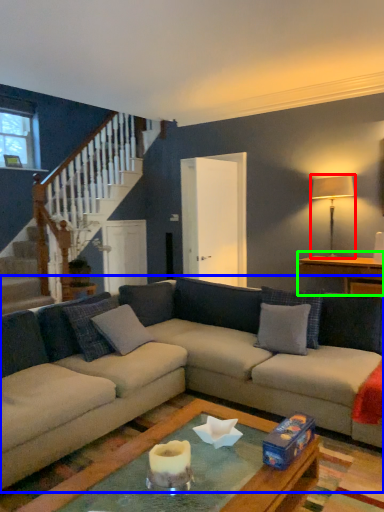
Question: Based on their relative distances, which object is farther from lamp (highlighted by a red box)? Choose from studio couch (highlighted by a blue box) and table (highlighted by a green box).

Choices:
 (A) studio couch
 (B) table

Answer: (A)